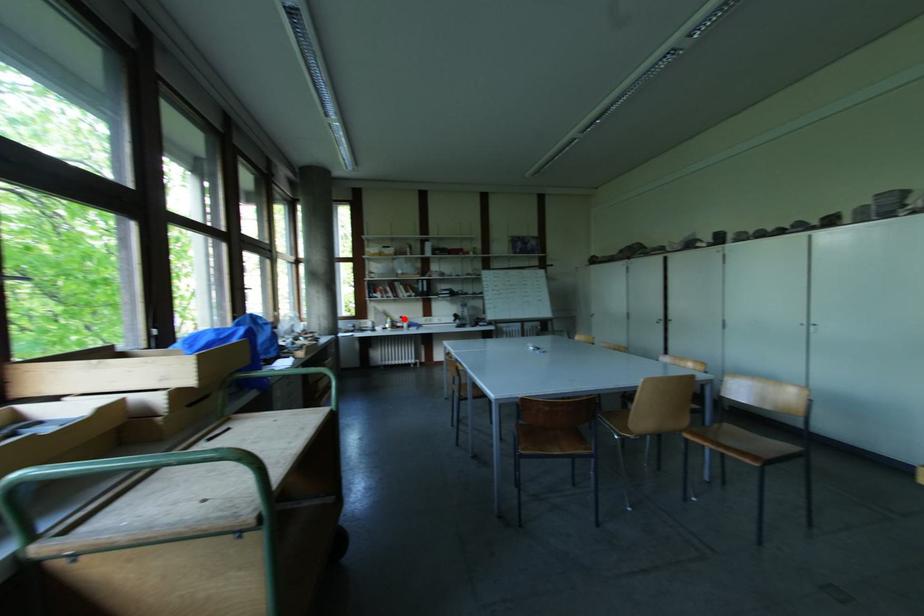
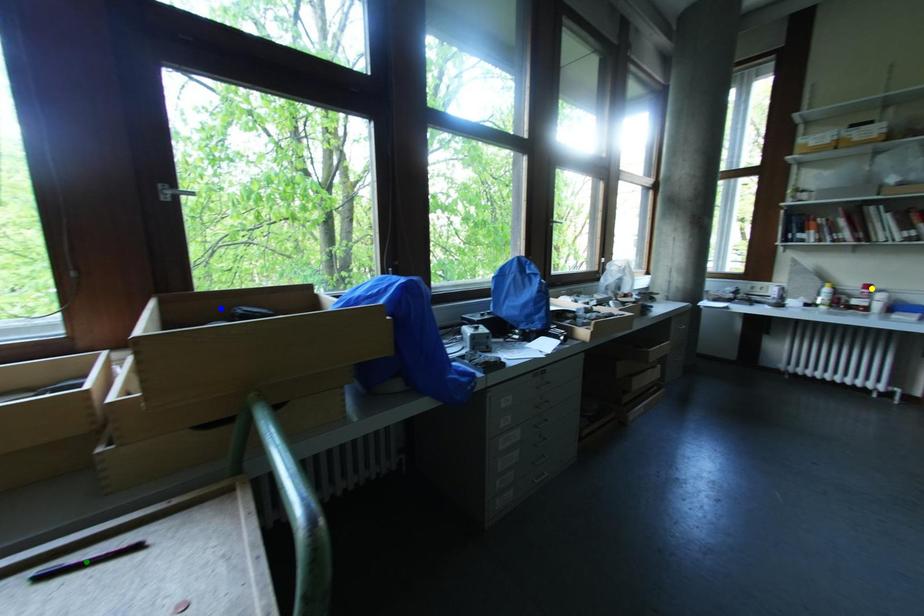
Question: I am providing you with two images of the same scene from different viewpoints. A red point is marked on the first image. You are given multiple points on the second image. Which point in image 2 represents the same 3d spot as the red point in image 1?

Choices:
 (A) yellow point
 (B) green point
 (C) blue point

Answer: (A)